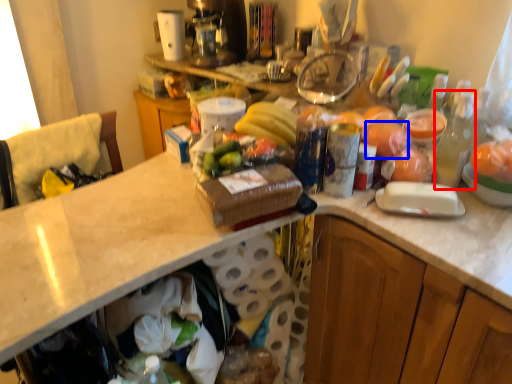
Question: Which object is closer to the camera taking this photo, bottle (highlighted by a red box) or food (highlighted by a blue box)?

Choices:
 (A) bottle
 (B) food

Answer: (A)